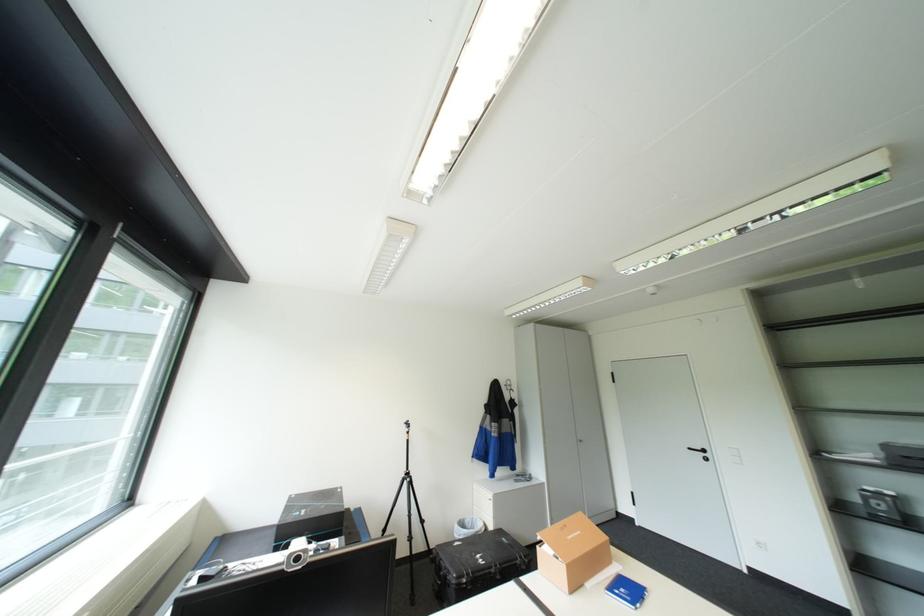
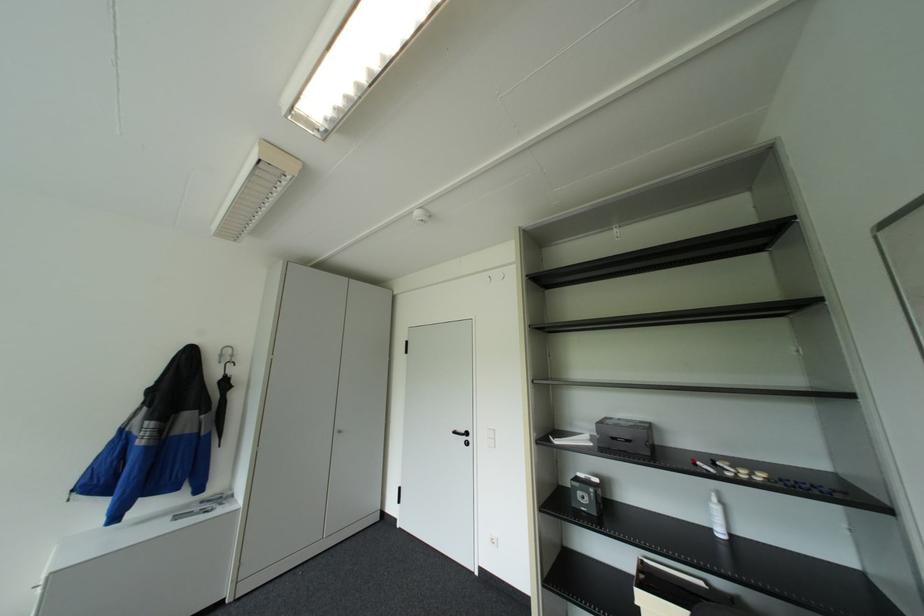
Locate, in the second image, the point that corresponds to point 698,447 in the first image.

(463, 431)